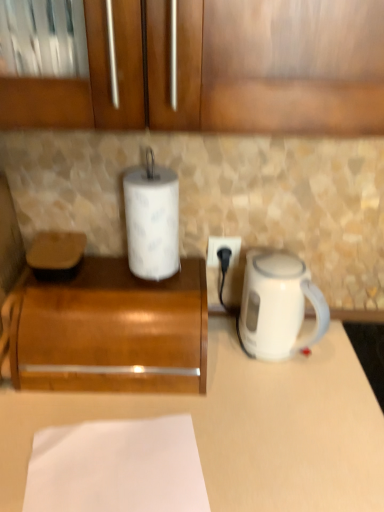
This screenshot has width=384, height=512. Find the location of `empty space that is ontop of white paper at lower center (from a real-world perspective)`. empty space that is ontop of white paper at lower center (from a real-world perspective) is located at coordinates (120, 465).